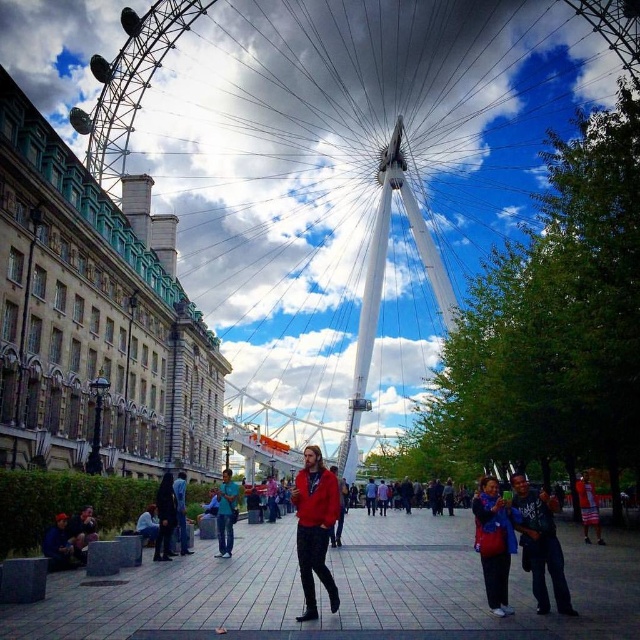
Question: Which object is positioned farthest from the dark blue jeans at lower left?

Choices:
 (A) matte red backpack at center
 (B) white metallic ferris wheel at center
 (C) red fabric shorts at lower right
 (D) dark blue jeans at lower right

Answer: (B)

Question: Can you confirm if red matte jacket at center is smaller than dark blue jeans at lower right?

Choices:
 (A) yes
 (B) no

Answer: (B)

Question: Based on their relative distances, which object is farther from the red matte jacket at center?

Choices:
 (A) dark blue jeans at lower right
 (B) matte red backpack at center
 (C) dark blue jeans at lower left

Answer: (A)

Question: Is dark blue jeans at lower left thinner than red fabric shorts at lower right?

Choices:
 (A) no
 (B) yes

Answer: (B)

Question: Which point is farther to the camera?

Choices:
 (A) (228, 513)
 (B) (157, 524)
 (C) (314, 602)
 (D) (584, 508)

Answer: (D)

Question: Where is white metallic ferris wheel at center located in relation to blue denim jeans at center in the image?

Choices:
 (A) left
 (B) right

Answer: (B)